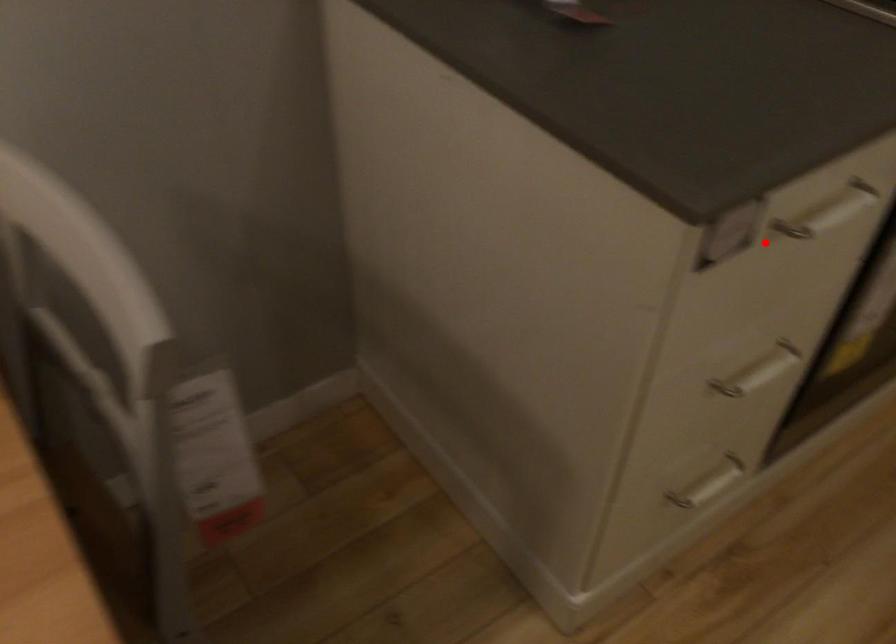
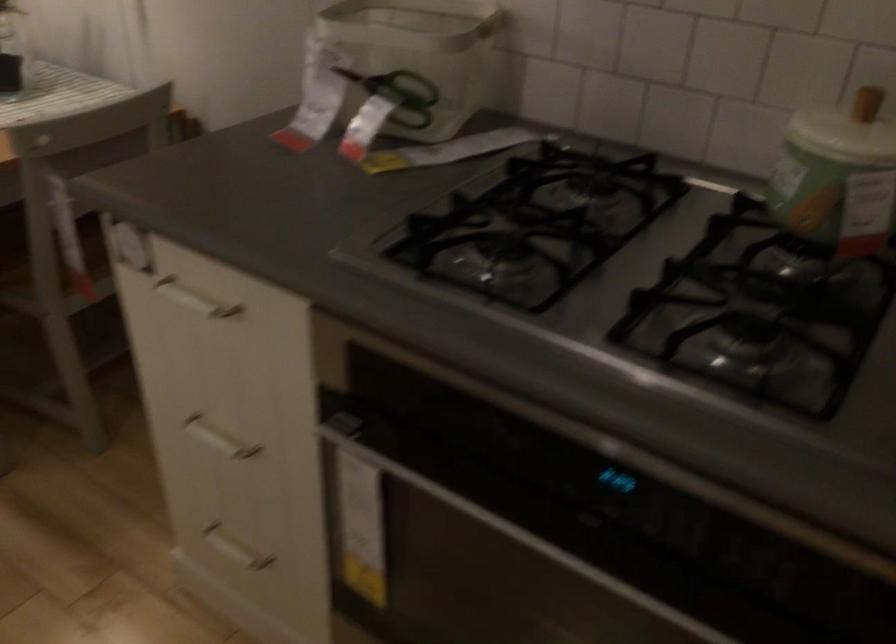
Question: I am providing you with two images of the same scene from different viewpoints. A red point is shown in image1. For the corresponding object point in image2, is it positioned nearer or farther from the camera?

Choices:
 (A) Nearer
 (B) Farther

Answer: (B)